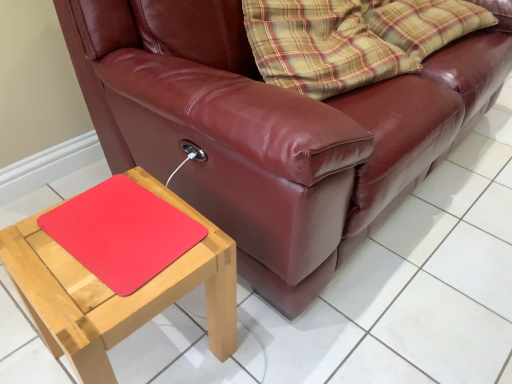
Question: Is rubberized red mouse pad at lower left positioned far away from leather couch at center?

Choices:
 (A) no
 (B) yes

Answer: (A)

Question: From the image's perspective, is rubberized red mouse pad at lower left over leather couch at center?

Choices:
 (A) yes
 (B) no

Answer: (B)

Question: Considering the relative sizes of rubberized red mouse pad at lower left and leather couch at center in the image provided, is rubberized red mouse pad at lower left wider than leather couch at center?

Choices:
 (A) yes
 (B) no

Answer: (B)

Question: Is rubberized red mouse pad at lower left at the left side of leather couch at center?

Choices:
 (A) yes
 (B) no

Answer: (A)

Question: Is rubberized red mouse pad at lower left in contact with leather couch at center?

Choices:
 (A) no
 (B) yes

Answer: (A)

Question: From a real-world perspective, is rubberized red mouse pad at lower left physically above leather couch at center?

Choices:
 (A) yes
 (B) no

Answer: (B)

Question: From the image's perspective, is natural wood table at lower left located above leather couch at center?

Choices:
 (A) yes
 (B) no

Answer: (B)

Question: Would you say leather couch at center is part of natural wood table at lower left's contents?

Choices:
 (A) no
 (B) yes

Answer: (A)

Question: Considering the relative positions of natural wood table at lower left and leather couch at center in the image provided, is natural wood table at lower left to the left of leather couch at center from the viewer's perspective?

Choices:
 (A) no
 (B) yes

Answer: (B)

Question: Is natural wood table at lower left next to leather couch at center?

Choices:
 (A) yes
 (B) no

Answer: (B)

Question: From a real-world perspective, is natural wood table at lower left beneath leather couch at center?

Choices:
 (A) no
 (B) yes

Answer: (B)

Question: Does natural wood table at lower left have a greater height compared to leather couch at center?

Choices:
 (A) yes
 (B) no

Answer: (B)

Question: Is rubberized red mouse pad at lower left at the left side of natural wood table at lower left?

Choices:
 (A) yes
 (B) no

Answer: (B)